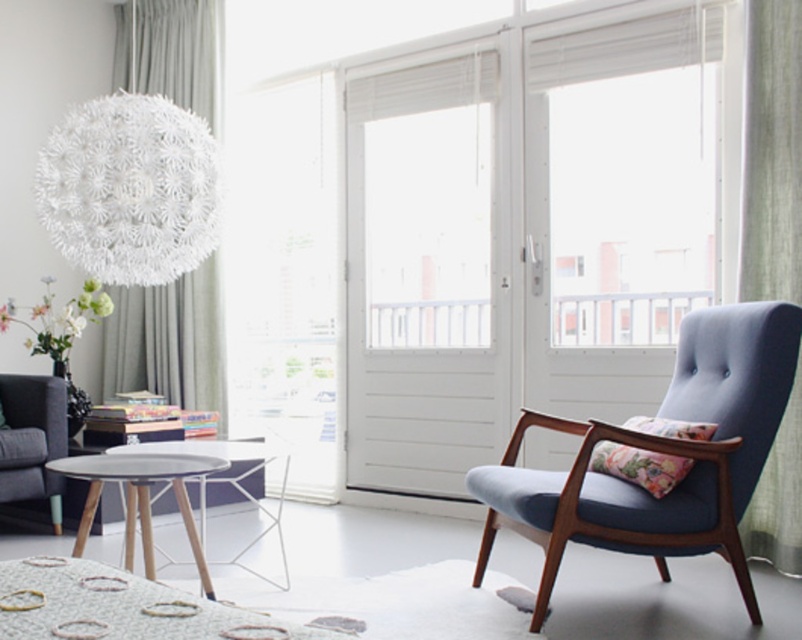
You are a guest entering the living room and want to place your bag on the highest available surface. Which object should you choose between the matte gray table at center and the floral fabric cushion at right?

The matte gray table at center is much taller than the floral fabric cushion at right, so you should place your bag on the matte gray table at center as it is the higher surface available.